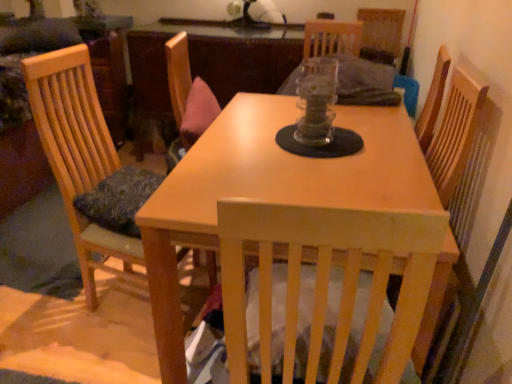
Question: Considering the relative sizes of light wood table at center and wooden chair at left in the image provided, is light wood table at center taller than wooden chair at left?

Choices:
 (A) no
 (B) yes

Answer: (A)

Question: From a real-world perspective, is light wood table at center located higher than wooden chair at left?

Choices:
 (A) no
 (B) yes

Answer: (A)

Question: From the image's perspective, would you say light wood table at center is positioned over wooden chair at left?

Choices:
 (A) no
 (B) yes

Answer: (A)

Question: Is light wood table at center at the right side of wooden chair at left?

Choices:
 (A) no
 (B) yes

Answer: (B)

Question: Is light wood table at center in front of wooden chair at left?

Choices:
 (A) no
 (B) yes

Answer: (B)

Question: Is light wood table at center facing away from wooden chair at left?

Choices:
 (A) yes
 (B) no

Answer: (B)

Question: From a real-world perspective, is wooden chair at left physically above light wood table at center?

Choices:
 (A) no
 (B) yes

Answer: (B)

Question: Does wooden chair at left have a greater height compared to light wood table at center?

Choices:
 (A) no
 (B) yes

Answer: (B)

Question: Is wooden chair at left facing towards light wood table at center?

Choices:
 (A) yes
 (B) no

Answer: (A)

Question: Can you confirm if wooden chair at left is bigger than light wood table at center?

Choices:
 (A) no
 (B) yes

Answer: (A)

Question: Does wooden chair at left have a smaller size compared to light wood table at center?

Choices:
 (A) no
 (B) yes

Answer: (B)

Question: From the image's perspective, would you say wooden chair at left is positioned over light wood table at center?

Choices:
 (A) no
 (B) yes

Answer: (B)

Question: In the image, is wooden chair at left positioned in front of or behind light wood table at center?

Choices:
 (A) front
 (B) behind

Answer: (B)